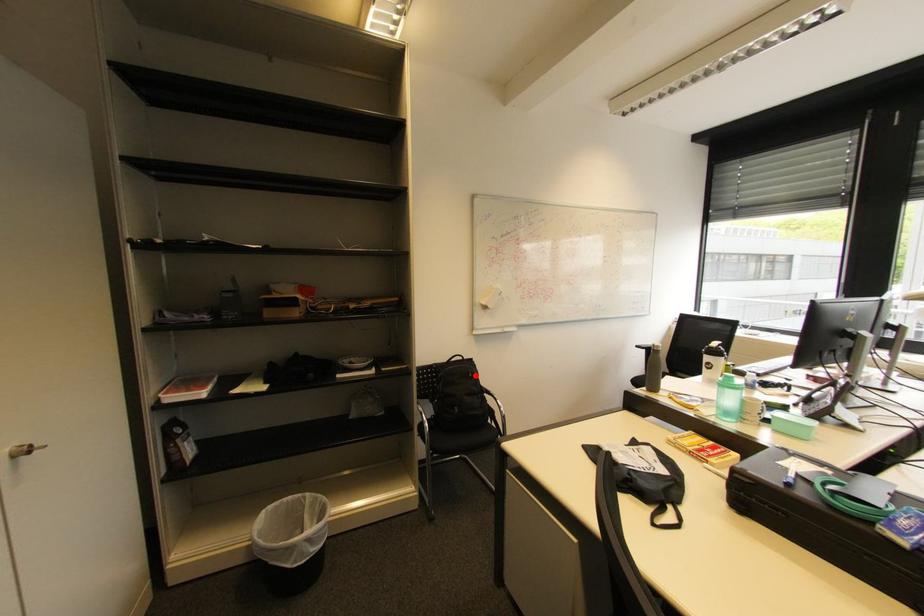
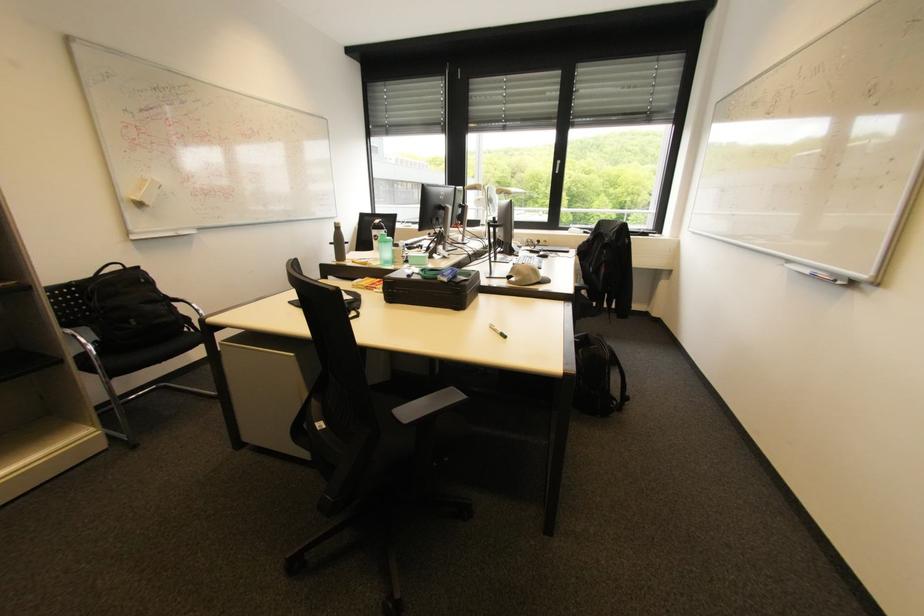
In the second image, find the point that corresponds to the highlighted location in the first image.

(148, 281)